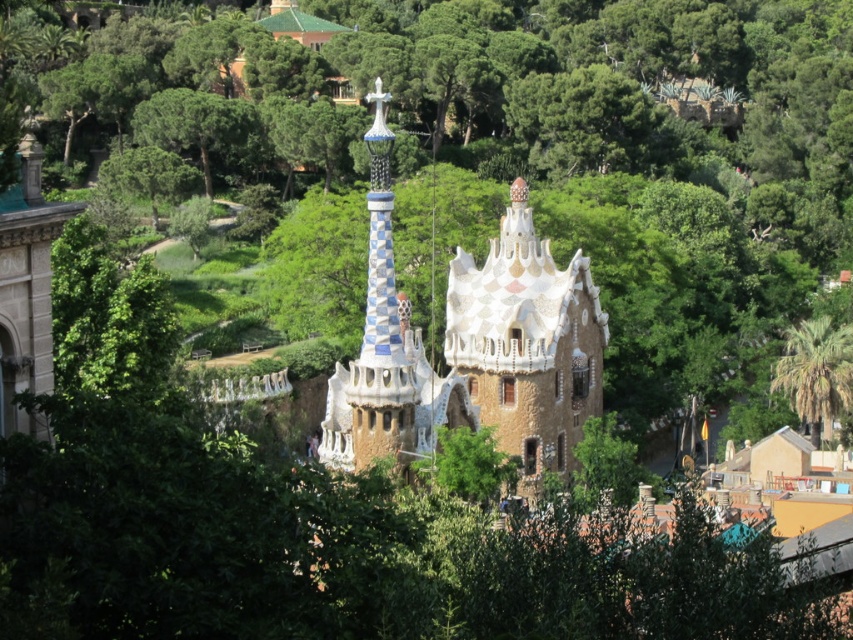
You are a tourist standing in front of the Park Gell building and want to take a photo that includes both the white mosaic tower at center and the green leafy palm tree at right. Based on their positions, which object should be placed on the left side of your photo?

The white mosaic tower at center should be placed on the left side of your photo because it is to the left of the green leafy palm tree at right.

You are an architect visiting Park Guel in Barcelona. You see the white mosaic tower at center and the white mosaic spire at center. Which one is taller?

The white mosaic spire at center is taller than the white mosaic tower at center.

Based on the photo, you are a tourist visiting Park Guel in Barcelona and want to take a photo of the white mosaic tower at center and the green leafy palm tree at right. Which object will appear larger in your photo?

The white mosaic tower at center will appear larger in your photo because it is much taller than the green leafy palm tree at right.